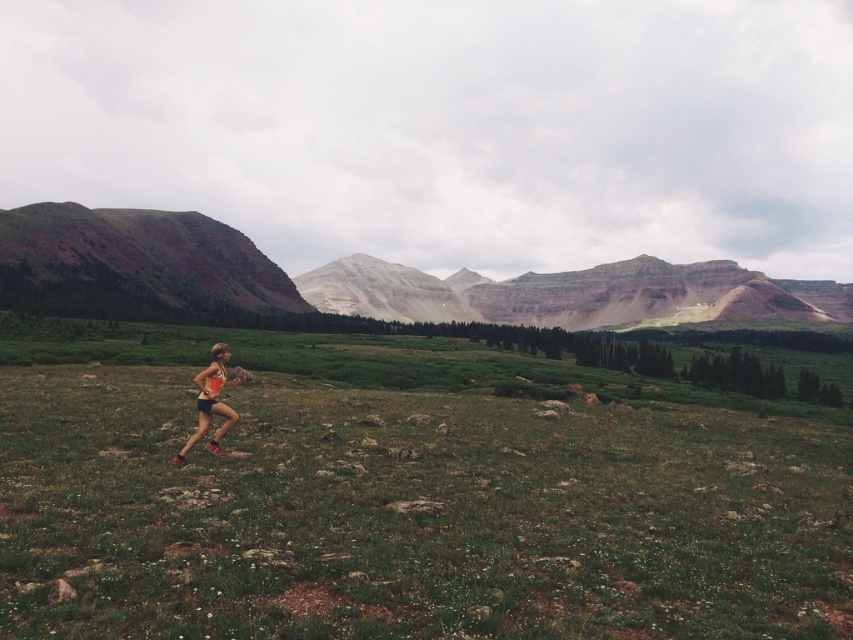
You are the runner in the scene. You want to get to the top of the rustic rock hillside at left. Which direction should you move relative to your current position at the orange fabric running suit at center?

The rustic rock hillside at left is located above the orange fabric running suit at center, so you should move upward from your current position at the orange fabric running suit at center to reach the top of the rustic rock hillside at left.

Consider the image. You are a hiker planning to navigate through the grassy field in the scene. There is a rustic brown cliff at left located at point (358,280). Can you safely walk around it without encountering steep terrain?

The rustic brown cliff at left is located at point (358,280). Since the grassy field has scattered rocks and uneven terrain, there might be areas with steep slopes near the cliff. It is advisable to exercise caution and choose a path away from the cliff to avoid potential hazards.

You are a hiker planning to take a photo of the rustic rock hillside at left. You need to position yourself at point (136, 260) to capture the best angle. Is this point located on the rustic rock hillside at left?

Yes, the point (136, 260) is located on the rustic rock hillside at left as it corresponds to that specific area.